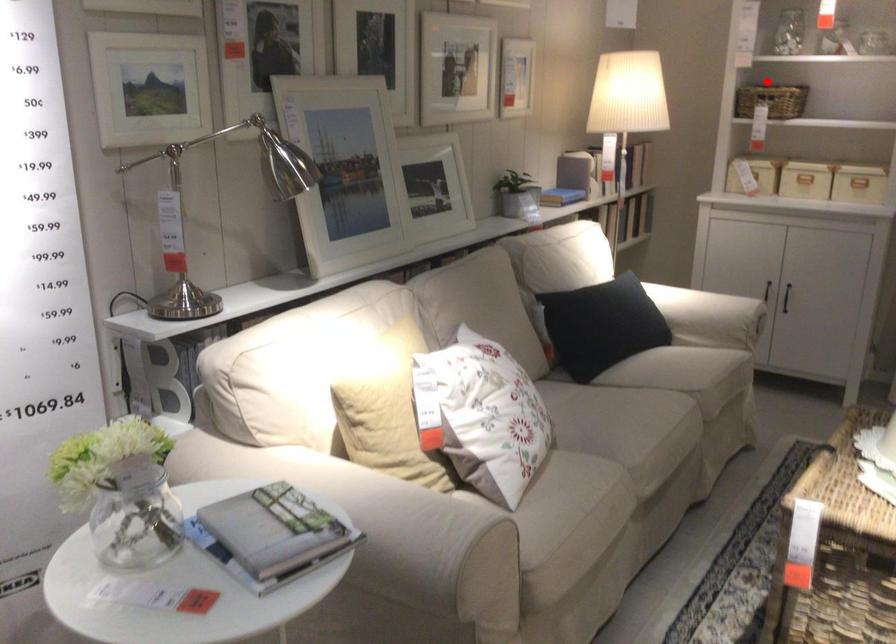
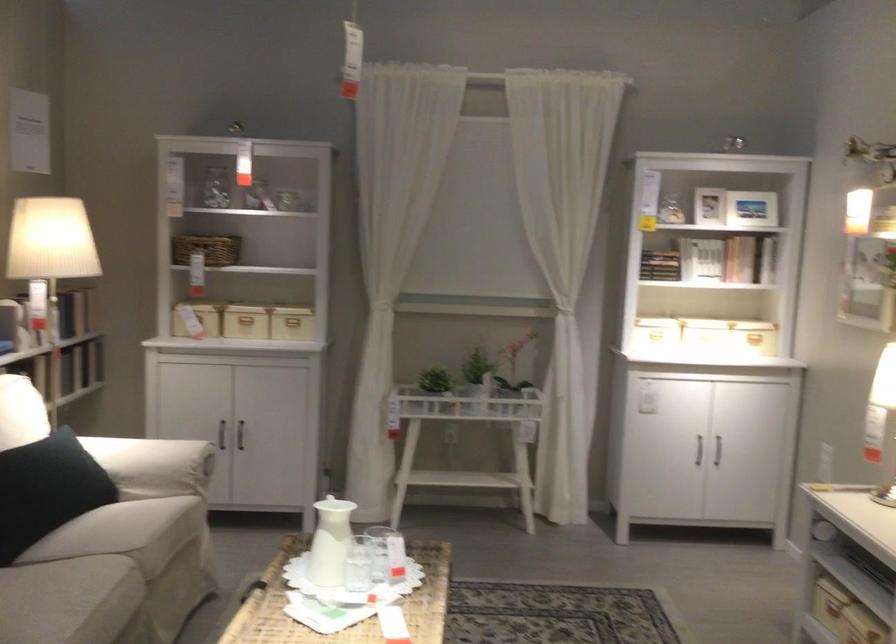
Where in the second image is the point corresponding to the highlighted location from the first image?

(207, 249)